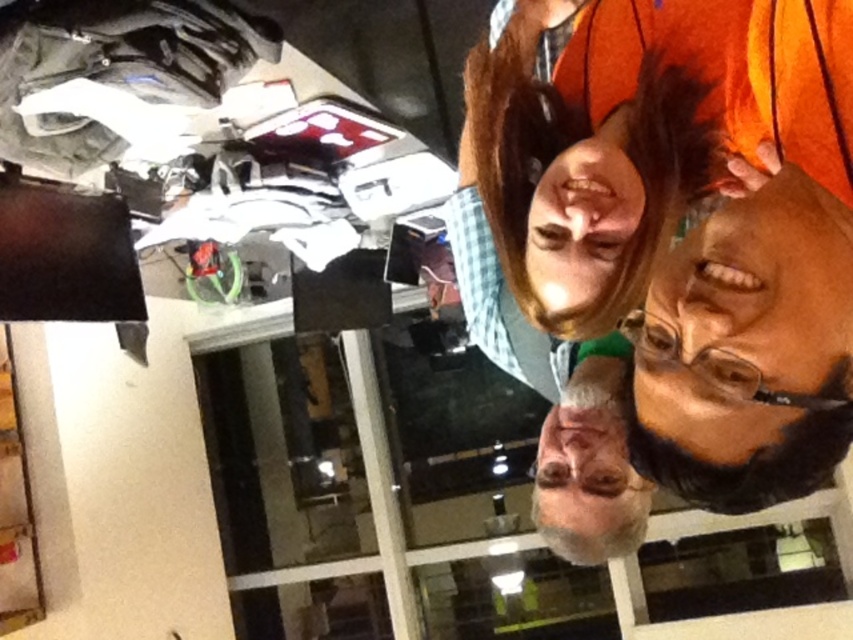
Question: Which point is farther to the camera?

Choices:
 (A) (799, 259)
 (B) (561, 154)

Answer: (B)

Question: In this image, where is matte black glasses at lower right located relative to smooth skin face at center?

Choices:
 (A) below
 (B) above

Answer: (A)

Question: Which point appears closest to the camera in this image?

Choices:
 (A) (766, 195)
 (B) (619, 148)

Answer: (A)

Question: Does matte black glasses at lower right have a lesser width compared to smooth skin face at center?

Choices:
 (A) yes
 (B) no

Answer: (B)

Question: Does matte black glasses at lower right appear on the right side of smooth skin face at center?

Choices:
 (A) no
 (B) yes

Answer: (B)

Question: Among these points, which one is nearest to the camera?

Choices:
 (A) (770, 444)
 (B) (572, 188)

Answer: (A)